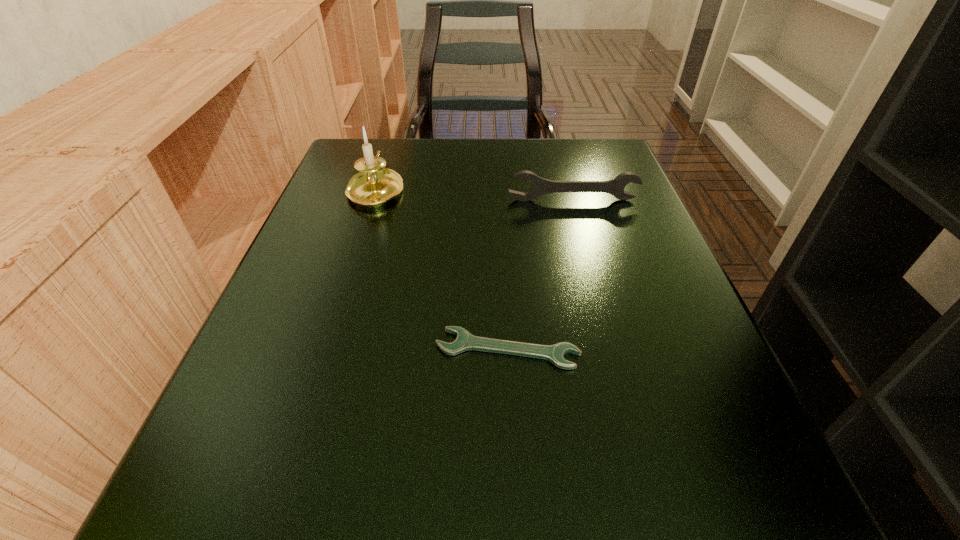
Image resolution: width=960 pixels, height=540 pixels. I want to click on blank area located on the back of the shorter wrench, so (x=502, y=247).

Find the location of `object at the far edge`. object at the far edge is located at coordinates (374, 185).

At what (x,y) coordinates should I click in order to perform the action: click on object located in the left edge section of the desktop. Please return your answer as a coordinate pair (x, y). The image size is (960, 540). Looking at the image, I should click on (374, 185).

Where is `object situated at the right edge`? The image size is (960, 540). object situated at the right edge is located at coordinates (539, 186).

You are a GUI agent. You are given a task and a screenshot of the screen. Output one action in this format:
    pyautogui.click(x=<x>, y=<y>)
    Task: Click on the object at the far left corner
    This screenshot has height=540, width=960.
    Given the screenshot: What is the action you would take?
    pyautogui.click(x=374, y=185)

In the image, there is a desktop. Where is `vacant space at the far edge`? vacant space at the far edge is located at coordinates (486, 160).

Where is `blank space at the near edge of the desktop`? blank space at the near edge of the desktop is located at coordinates (478, 507).

The image size is (960, 540). In the image, there is a desktop. Identify the location of vacant space at the left edge. 319,252.

Identify the location of vacant region at the right edge of the desktop. Image resolution: width=960 pixels, height=540 pixels. (569, 234).

You are a GUI agent. You are given a task and a screenshot of the screen. Output one action in this format:
    pyautogui.click(x=<x>, y=<y>)
    Task: Click on the vacant space at the near left corner of the desktop
    
    Given the screenshot: What is the action you would take?
    pyautogui.click(x=267, y=470)